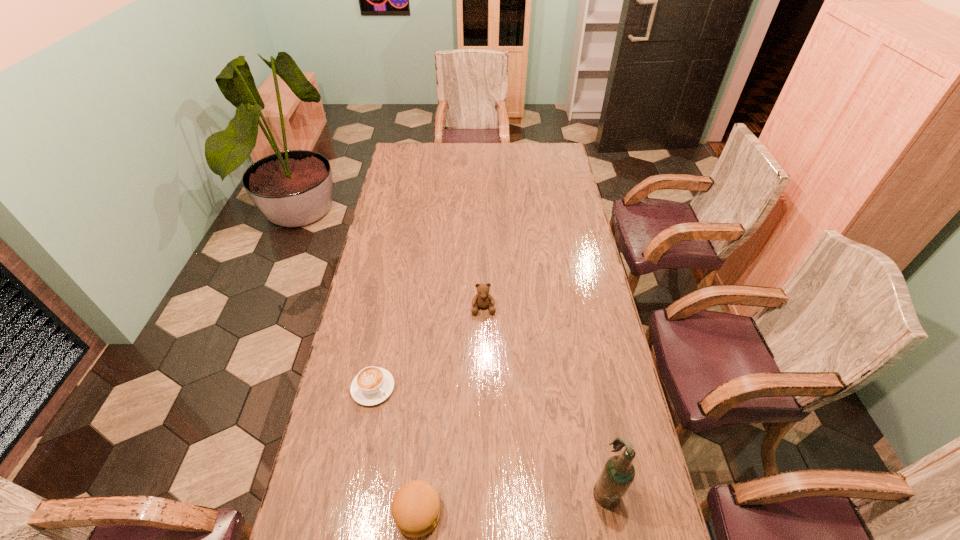
This screenshot has height=540, width=960. Identify the location of blank region between the third object from right to left and the shortest object. (396, 450).

Where is `vacant area between the leftmost object and the second shortest object`? The width and height of the screenshot is (960, 540). vacant area between the leftmost object and the second shortest object is located at coordinates (396, 450).

Where is `vacant space that's between the second shortest object and the farthest object`? The height and width of the screenshot is (540, 960). vacant space that's between the second shortest object and the farthest object is located at coordinates [450, 410].

The height and width of the screenshot is (540, 960). I want to click on free point between the shortest object and the rightmost object, so click(x=490, y=438).

Locate an element on the screen. The height and width of the screenshot is (540, 960). empty location between the beer bottle and the shortest object is located at coordinates (490, 438).

Find the location of a particular element. This screenshot has height=540, width=960. free space between the tallest object and the hamburger is located at coordinates (512, 501).

Identify the location of object that stands as the second closest to the third tallest object. The image size is (960, 540). (618, 473).

Where is `object identified as the second closest to the farthest object`? Image resolution: width=960 pixels, height=540 pixels. object identified as the second closest to the farthest object is located at coordinates (416, 508).